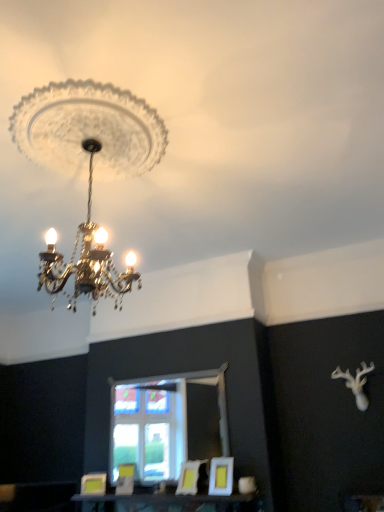
Describe the element at coordinates (89, 169) in the screenshot. I see `matte gold chandelier at upper left` at that location.

You are a GUI agent. You are given a task and a screenshot of the screen. Output one action in this format:
    pyautogui.click(x=<x>, y=<y>)
    Task: Click on the matte gold chandelier at upper left
    
    Given the screenshot: What is the action you would take?
    pyautogui.click(x=89, y=169)

The height and width of the screenshot is (512, 384). What are the coordinates of `matte gold chandelier at upper left` in the screenshot? It's located at (89, 169).